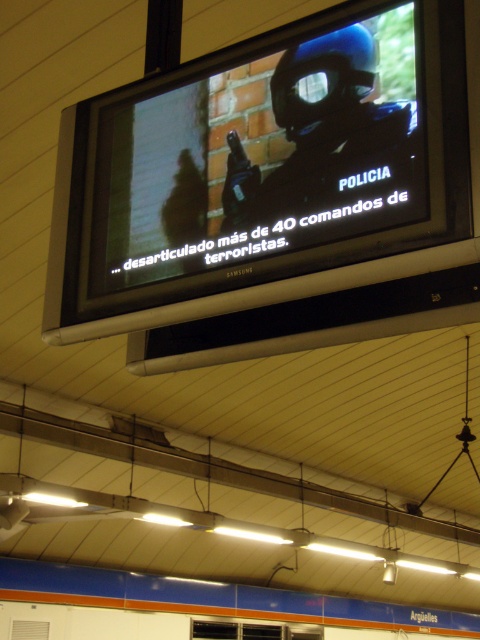
Is matte black screen at upper center taller than matte black helmet at center?

Yes.

Between matte black screen at upper center and matte black helmet at center, which one is positioned lower?

Positioned lower is matte black screen at upper center.

Between point (287, 204) and point (347, 172), which one is positioned behind?

The point (287, 204) is more distant.

You are a GUI agent. You are given a task and a screenshot of the screen. Output one action in this format:
    pyautogui.click(x=<x>, y=<y>)
    Task: Click on the matte black screen at upper center
    Image resolution: width=480 pixels, height=640 pixels.
    Given the screenshot: What is the action you would take?
    pyautogui.click(x=263, y=156)